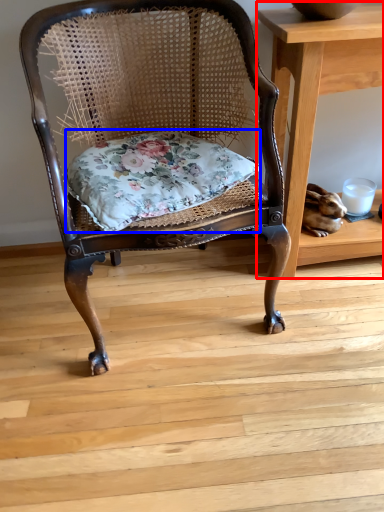
Question: Among these objects, which one is farthest to the camera, table (highlighted by a red box) or pillow (highlighted by a blue box)?

Choices:
 (A) table
 (B) pillow

Answer: (A)